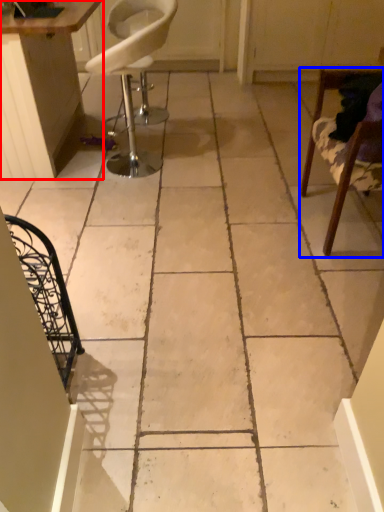
Question: Which object is closer to the camera taking this photo, table (highlighted by a red box) or chair (highlighted by a blue box)?

Choices:
 (A) table
 (B) chair

Answer: (B)